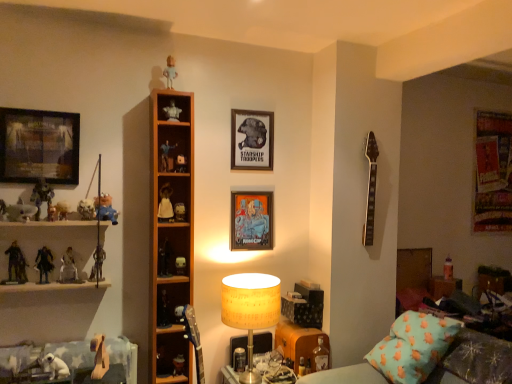
Question: From a real-world perspective, is white matte doll at center, acting as the tenth toy starting from the right, positioned above or below matte black picture frame at upper left, the 4th picture frame when ordered from right to left?

Choices:
 (A) above
 (B) below

Answer: (B)

Question: From the image's perspective, relative to matte black picture frame at upper left, the fourth picture frame from the back, is white matte doll at center, acting as the tenth toy starting from the right, above or below?

Choices:
 (A) above
 (B) below

Answer: (B)

Question: Which object is the farthest from the matte plastic toy at center, acting as the 16th toy starting from the left?

Choices:
 (A) plastic blue figure at upper center, which is the 7th toy in right-to-left order
 (B) plush blue bear at left, placed as the 11th toy when sorted from right to left
 (C) metallic silver figure at left, which ranks as the twelfth toy in right-to-left order
 (D) matte paper picture frame at center, placed as the 3th picture frame when sorted from left to right
 (E) matte black figurine at center, the eleventh toy from the left

Answer: (C)

Question: Based on their relative distances, which object is farther from the matte black picture frame at upper left, the 1th picture frame when ordered from left to right?

Choices:
 (A) teal fabric couch at lower right
 (B) translucent plastic bottle at lower center, the nineteenth toy when ordered from left to right
 (C) white fabric bed frame at lower left
 (D) white matte doll at center, acting as the tenth toy starting from the right
 (E) metallic silver figure at left, which ranks as the twelfth toy in right-to-left order

Answer: (A)